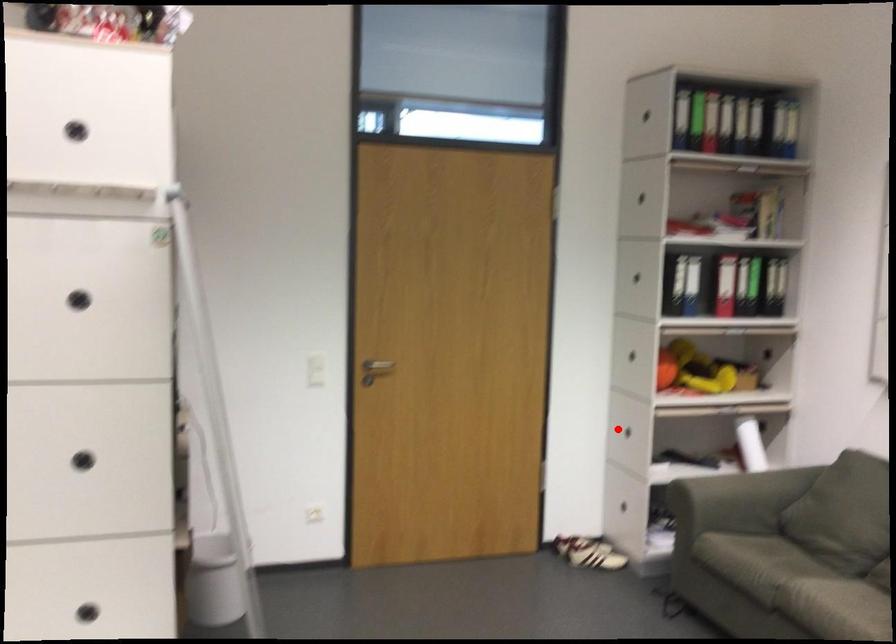
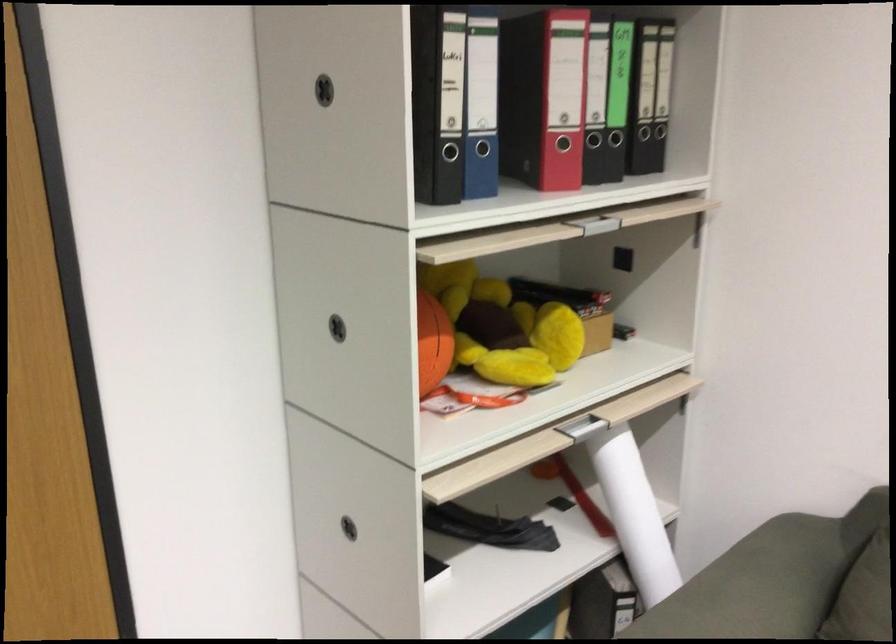
Question: I am providing you with two images of the same scene from different viewpoints. Image1 has a red point marked. In image2, the corresponding 3D location appears at what relative position? Reply with the corresponding letter.

Choices:
 (A) Closer
 (B) Farther

Answer: (A)